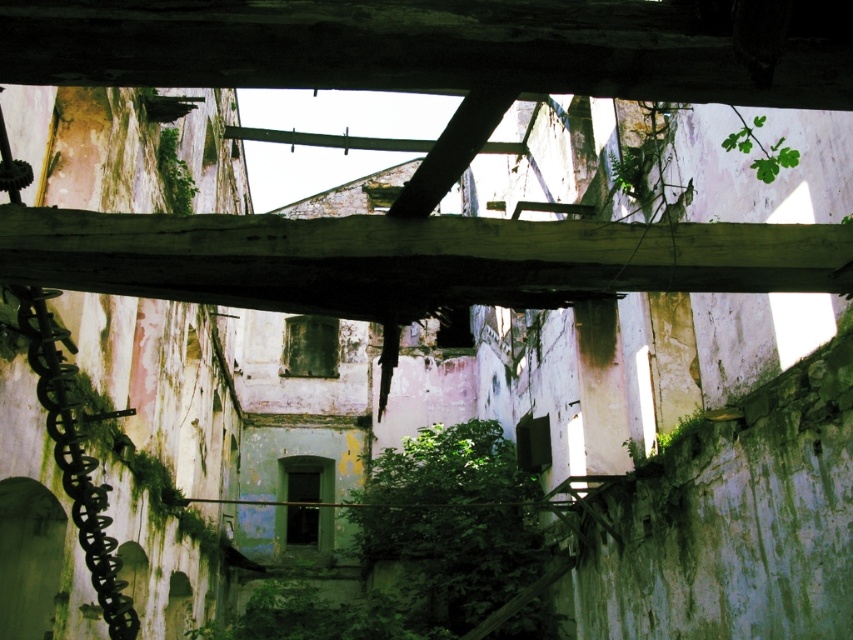
Question: Does green wood beam at center appear on the right side of green leafy plant at center?

Choices:
 (A) no
 (B) yes

Answer: (B)

Question: Among these points, which one is farthest from the camera?

Choices:
 (A) (157, 145)
 (B) (399, 509)
 (C) (329, 252)

Answer: (B)

Question: Does green leafy bush at center appear under green leafy plant at center?

Choices:
 (A) yes
 (B) no

Answer: (A)

Question: Is green wood beam at center further to the viewer compared to green leafy plant at center?

Choices:
 (A) yes
 (B) no

Answer: (B)

Question: Which object appears farthest from the camera in this image?

Choices:
 (A) green leafy bush at center
 (B) green wood beam at center
 (C) green leafy plant at center

Answer: (A)

Question: Which object appears closest to the camera in this image?

Choices:
 (A) green leafy plant at center
 (B) green wood beam at center

Answer: (B)